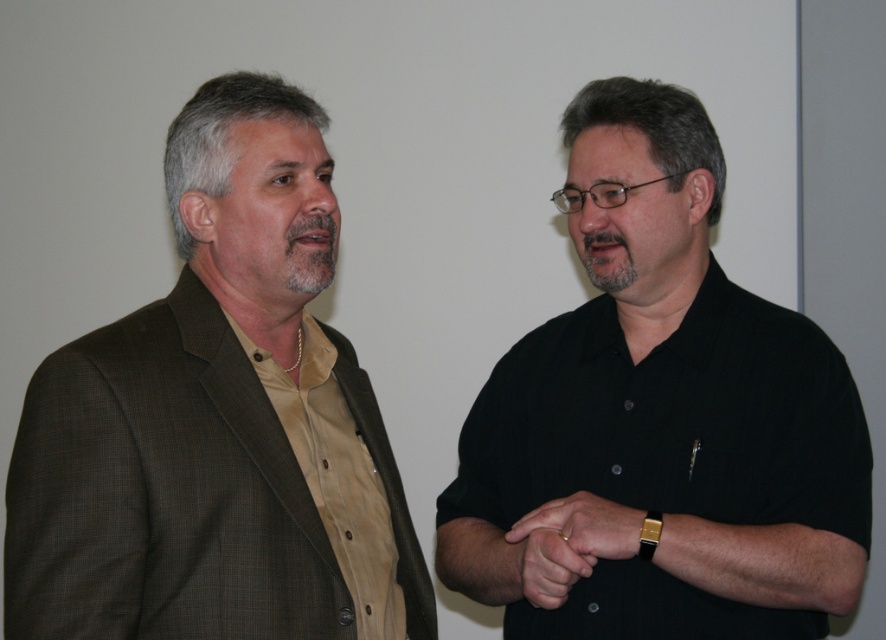
Question: Which of the following is the closest to the observer?

Choices:
 (A) brown textured suit at left
 (B) gold metallic watch at center
 (C) black matte shirt at right

Answer: (A)

Question: Does gold metallic watch at center appear on the right side of smooth skin hand at center?

Choices:
 (A) no
 (B) yes

Answer: (B)

Question: Which point is closer to the camera?

Choices:
 (A) (856, 458)
 (B) (243, 321)

Answer: (B)

Question: Which of the following is the closest to the observer?

Choices:
 (A) brown textured suit at left
 (B) black matte shirt at right
 (C) gold metallic watch at center
 (D) smooth skin hand at center

Answer: (A)

Question: Does brown textured suit at left have a larger size compared to gold metallic watch at center?

Choices:
 (A) yes
 (B) no

Answer: (A)

Question: Is brown textured suit at left in front of smooth skin hand at center?

Choices:
 (A) yes
 (B) no

Answer: (A)